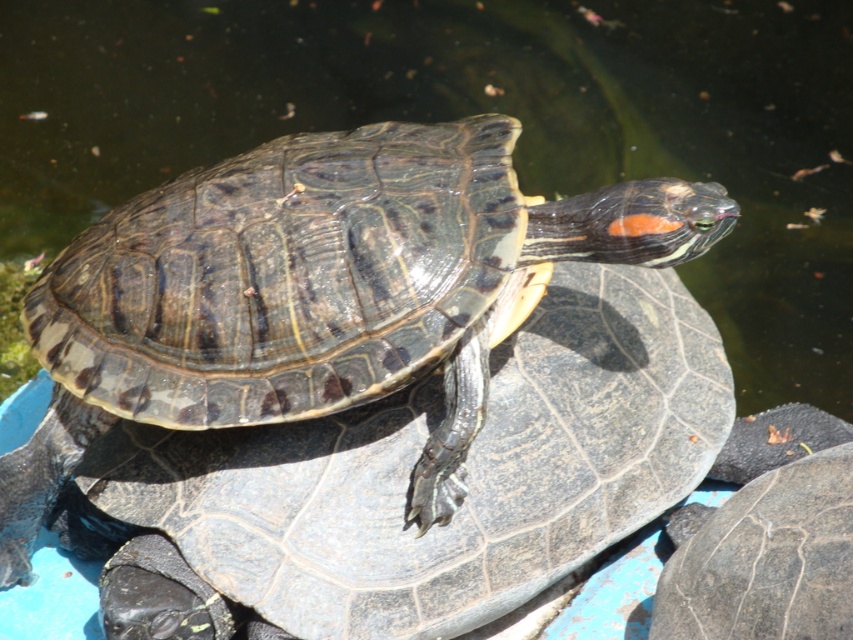
Can you confirm if shiny dark tortoise at center is bigger than dark gray textured shell at center?

Yes, shiny dark tortoise at center is bigger than dark gray textured shell at center.

Does shiny dark tortoise at center appear over dark gray textured shell at center?

Yes.

Who is more distant from viewer, (84, 288) or (730, 563)?

The point (84, 288) is more distant.

Image resolution: width=853 pixels, height=640 pixels. Identify the location of shiny dark tortoise at center. (318, 294).